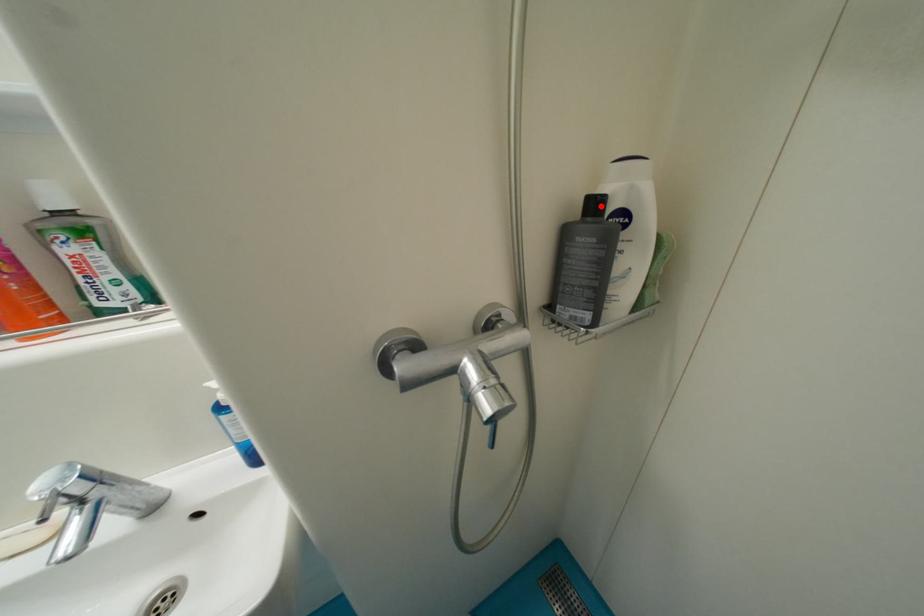
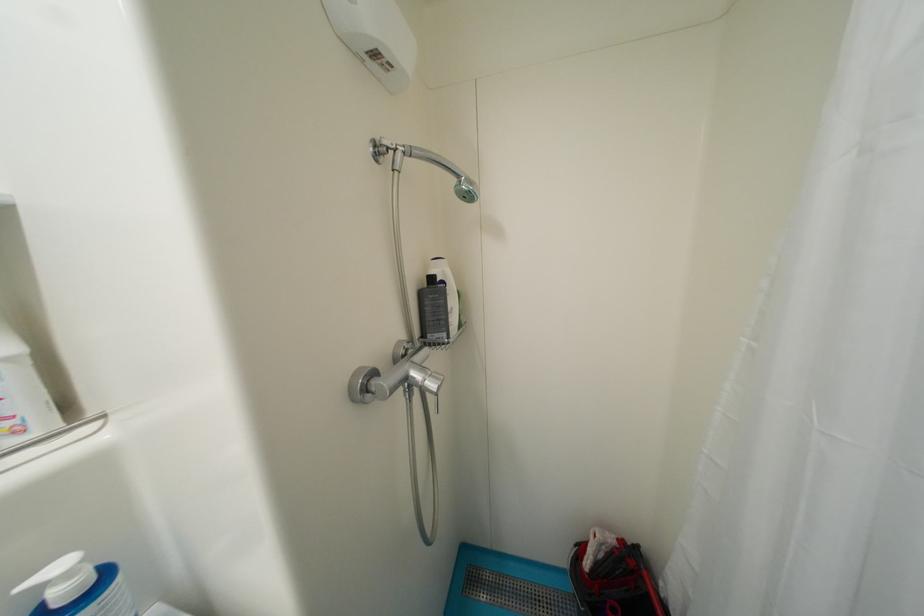
Where in the second image is the point corresponding to the highlighted location from the first image?

(439, 281)